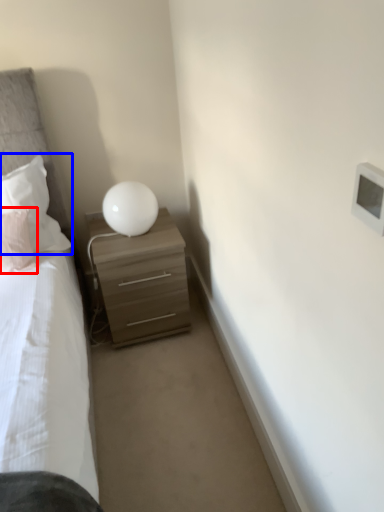
Question: Which object appears farthest to the camera in this image, pillow (highlighted by a red box) or pillow (highlighted by a blue box)?

Choices:
 (A) pillow
 (B) pillow

Answer: (B)